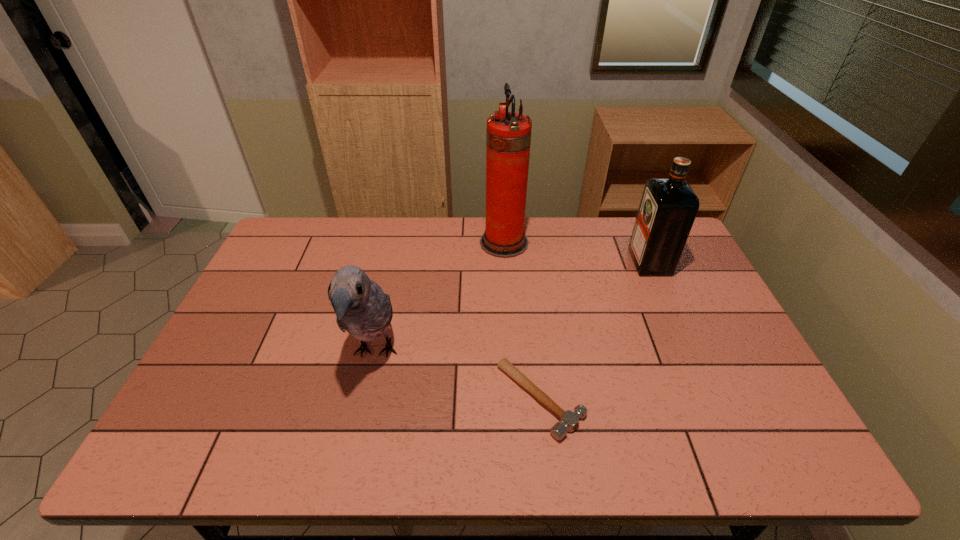
At what (x,y) coordinates should I click in order to perform the action: click on vacant point located between the tallest object and the rightmost object. Please return your answer as a coordinate pair (x, y). Looking at the image, I should click on (577, 252).

Locate an element on the screen. blank region between the rightmost object and the hammer is located at coordinates (595, 331).

Find the location of a particular element. object that ranks as the third closest to the parrot is located at coordinates (668, 207).

You are a GUI agent. You are given a task and a screenshot of the screen. Output one action in this format:
    pyautogui.click(x=<x>, y=<y>)
    Task: Click on the object identified as the second closest to the leftmost object
    Image resolution: width=960 pixels, height=540 pixels.
    Given the screenshot: What is the action you would take?
    pyautogui.click(x=508, y=137)

Where is `vacant area in the image that satisfies the following two spatial constraints: 1. at the discharge end of the hammer; 2. on the right side of the tallest object`? The image size is (960, 540). vacant area in the image that satisfies the following two spatial constraints: 1. at the discharge end of the hammer; 2. on the right side of the tallest object is located at coordinates (515, 400).

Locate an element on the screen. The image size is (960, 540). vacant space that satisfies the following two spatial constraints: 1. on the front label of the rightmost object; 2. on the front-facing side of the leftmost object is located at coordinates (690, 353).

Find the location of `free point that satisfies the following two spatial constraints: 1. on the front label of the liquor; 2. on the front-facing side of the leftmost object`. free point that satisfies the following two spatial constraints: 1. on the front label of the liquor; 2. on the front-facing side of the leftmost object is located at coordinates 690,353.

This screenshot has height=540, width=960. In order to click on free space that satisfies the following two spatial constraints: 1. on the back side of the hammer; 2. at the discharge end of the fire extinguisher in this screenshot , I will do `click(522, 242)`.

Locate an element on the screen. blank space that satisfies the following two spatial constraints: 1. at the discharge end of the fire extinguisher; 2. on the right side of the hammer is located at coordinates (515, 400).

You are a GUI agent. You are given a task and a screenshot of the screen. Output one action in this format:
    pyautogui.click(x=<x>, y=<y>)
    Task: Click on the blank space that satisfies the following two spatial constraints: 1. at the discharge end of the shortest object; 2. on the left side of the tallest object
    The image size is (960, 540).
    Given the screenshot: What is the action you would take?
    pyautogui.click(x=515, y=400)